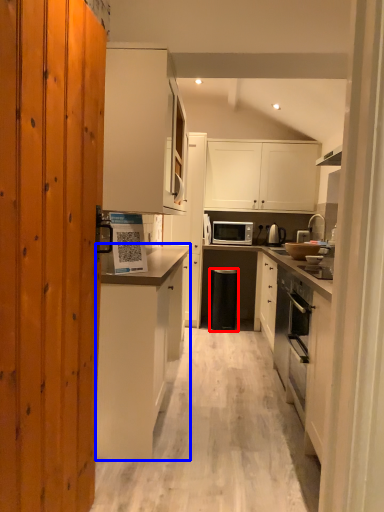
Question: Which object appears farthest to the camera in this image, trash bin/can (highlighted by a red box) or cabinetry (highlighted by a blue box)?

Choices:
 (A) trash bin/can
 (B) cabinetry

Answer: (A)